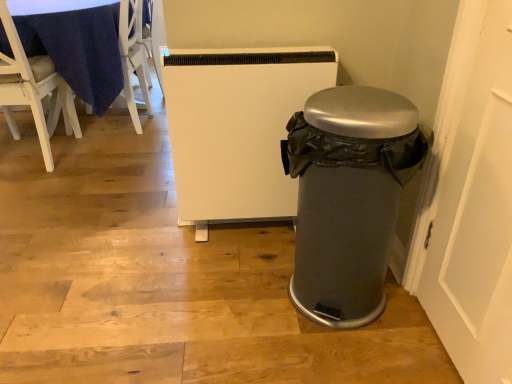
Question: In terms of width, does white wood chair at upper left, the 1th chair viewed from the right, look wider or thinner when compared to white wood chair at left, marked as the 2th chair in a right-to-left arrangement?

Choices:
 (A) thin
 (B) wide

Answer: (A)

Question: Based on their sizes in the image, would you say white wood chair at upper left, the 1th chair viewed from the right, is bigger or smaller than white wood chair at left, marked as the 2th chair in a right-to-left arrangement?

Choices:
 (A) small
 (B) big

Answer: (A)

Question: Is point (138, 48) positioned closer to the camera than point (57, 109)?

Choices:
 (A) closer
 (B) farther

Answer: (B)

Question: Is white wood chair at left, placed as the first chair when sorted from left to right, wider or thinner than white wood chair at upper left, the 1th chair viewed from the right?

Choices:
 (A) thin
 (B) wide

Answer: (B)

Question: Is white wood chair at left, marked as the 2th chair in a right-to-left arrangement, inside or outside of white wood chair at upper left, the 1th chair viewed from the right?

Choices:
 (A) outside
 (B) inside

Answer: (A)

Question: In terms of height, does white wood chair at left, placed as the first chair when sorted from left to right, look taller or shorter compared to white wood chair at upper left, the 1th chair viewed from the right?

Choices:
 (A) tall
 (B) short

Answer: (A)

Question: Looking at the image, does white wood chair at left, marked as the 2th chair in a right-to-left arrangement, seem bigger or smaller compared to white wood chair at upper left, arranged as the 2th chair when viewed from the left?

Choices:
 (A) small
 (B) big

Answer: (B)